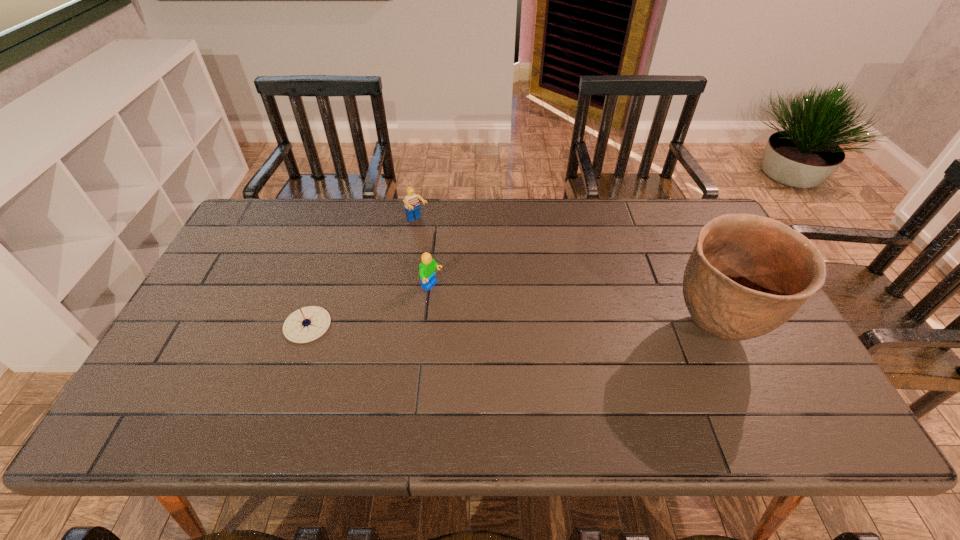
I want to click on vacant space located 0.340m on the face of the farther Lego, so click(482, 292).

At what (x,y) coordinates should I click in order to perform the action: click on vacant space situated 0.050m on the face of the nearer Lego. Please return your answer as a coordinate pair (x, y). This screenshot has width=960, height=540. Looking at the image, I should click on (455, 299).

Find the location of `free space located 0.310m on the face of the nearer Lego`. free space located 0.310m on the face of the nearer Lego is located at coordinates (537, 343).

The image size is (960, 540). Identify the location of free space located on the face of the nearer Lego. (555, 353).

Find the location of a particular element. The height and width of the screenshot is (540, 960). object that is at the far edge is located at coordinates (412, 206).

You are a GUI agent. You are given a task and a screenshot of the screen. Output one action in this format:
    pyautogui.click(x=<x>, y=<y>)
    Task: Click on the object positioned at the near edge
    This screenshot has width=960, height=540.
    Given the screenshot: What is the action you would take?
    pyautogui.click(x=747, y=275)

The image size is (960, 540). Find the location of `object that is at the right edge`. object that is at the right edge is located at coordinates (747, 275).

The height and width of the screenshot is (540, 960). In order to click on object present at the near right corner in this screenshot , I will do `click(747, 275)`.

The image size is (960, 540). In the image, there is a desktop. What are the coordinates of `vacant area at the far edge` in the screenshot? It's located at (534, 210).

At what (x,y) coordinates should I click in order to perform the action: click on free spot at the near edge of the desktop. Please return your answer as a coordinate pair (x, y). This screenshot has width=960, height=540. Looking at the image, I should click on (254, 395).